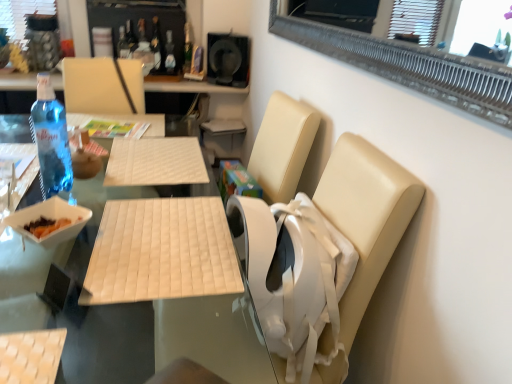
This screenshot has width=512, height=384. Find the location of `beige woven fabric armchair at lower left`. beige woven fabric armchair at lower left is located at coordinates (31, 356).

The height and width of the screenshot is (384, 512). What do you see at coordinates (228, 59) in the screenshot? I see `black matte speaker at upper center` at bounding box center [228, 59].

Describe the element at coordinates (366, 216) in the screenshot. I see `white leather chair at right` at that location.

Measure the distance between clear glass bottle at upper center, the third bottle ordered from the bottom, and camera.

They are 2.56 meters apart.

Locate an element on the screen. white quilted mat at center, marked as the first table in a top-to-bottom arrangement is located at coordinates (161, 252).

The height and width of the screenshot is (384, 512). Describe the element at coordinates (161, 252) in the screenshot. I see `white quilted mat at center, the second table in the bottom-to-top sequence` at that location.

This screenshot has width=512, height=384. In order to click on white quilted placemat at center, acting as the first table starting from the bottom in this screenshot , I will do `click(77, 299)`.

Between blue glass bottle at left, the 1th bottle in the front-to-back sequence, and transparent plastic bottle at upper center, which is the third bottle in front-to-back order, which one appears on the right side from the viewer's perspective?

Positioned to the right is transparent plastic bottle at upper center, which is the third bottle in front-to-back order.

Which object is thinner, blue glass bottle at left, the first bottle from the bottom, or transparent plastic bottle at upper center, marked as the second bottle in a back-to-front arrangement?

transparent plastic bottle at upper center, marked as the second bottle in a back-to-front arrangement, is thinner.

Where is `bottle that is the 2nd one when counting forward from the transparent plastic bottle at upper center, marked as the second bottle in a back-to-front arrangement`? This screenshot has width=512, height=384. bottle that is the 2nd one when counting forward from the transparent plastic bottle at upper center, marked as the second bottle in a back-to-front arrangement is located at coordinates (51, 139).

Is blue glass bottle at left, the first bottle from the bottom, directly adjacent to transparent plastic bottle at upper center, the second bottle in the bottom-to-top sequence?

blue glass bottle at left, the first bottle from the bottom, is not next to transparent plastic bottle at upper center, the second bottle in the bottom-to-top sequence, and they're not touching.

Considering the positions of point (185, 70) and point (64, 161), is point (185, 70) closer or farther from the camera than point (64, 161)?

Point (185, 70).

Does translucent glass bottle at upper center, marked as the 1th bottle in a back-to-front arrangement, appear on the right side of blue glass bottle at left, arranged as the 4th bottle when viewed from the top?

Yes.

From a real-world perspective, who is located higher, translucent glass bottle at upper center, which appears as the 1th bottle when viewed from the top, or blue glass bottle at left, arranged as the 4th bottle when viewed from the top?

translucent glass bottle at upper center, which appears as the 1th bottle when viewed from the top, is physically above.

Which bottle is the 4th one when counting from the left side of the black matte speaker at upper center? Please provide its 2D coordinates.

[(156, 44)]

How many degrees apart are the facing directions of black matte speaker at upper center and clear glass bottle at upper center, which appears as the 2th bottle when viewed from the top?

The angular difference between black matte speaker at upper center and clear glass bottle at upper center, which appears as the 2th bottle when viewed from the top, is 0.000471 degrees.

From the picture: From the image's perspective, is black matte speaker at upper center located beneath clear glass bottle at upper center, the third bottle in the back-to-front sequence?

Indeed, from the image's perspective, black matte speaker at upper center is shown beneath clear glass bottle at upper center, the third bottle in the back-to-front sequence.

Which of these two, black matte speaker at upper center or translucent glass bottle at upper center, marked as the 1th bottle in a back-to-front arrangement, is bigger?

black matte speaker at upper center is bigger.

Could you tell me if black matte speaker at upper center is facing translucent glass bottle at upper center, marked as the 1th bottle in a back-to-front arrangement?

No, black matte speaker at upper center is not oriented towards translucent glass bottle at upper center, marked as the 1th bottle in a back-to-front arrangement.

Is black matte speaker at upper center wider than translucent glass bottle at upper center, marked as the 1th bottle in a back-to-front arrangement?

Indeed, black matte speaker at upper center has a greater width compared to translucent glass bottle at upper center, marked as the 1th bottle in a back-to-front arrangement.

From a real-world perspective, does black matte speaker at upper center sit lower than translucent glass bottle at upper center, which is the 4th bottle from front to back?

Yes.

Does white quilted placemat at center, acting as the first table starting from the bottom, come in front of transparent plastic bottle at upper center, which is the third bottle in front-to-back order?

Yes, white quilted placemat at center, acting as the first table starting from the bottom, is in front of transparent plastic bottle at upper center, which is the third bottle in front-to-back order.

Based on the photo, would you say white quilted placemat at center, acting as the first table starting from the bottom, contains transparent plastic bottle at upper center, acting as the 3th bottle starting from the top?

No, transparent plastic bottle at upper center, acting as the 3th bottle starting from the top, is not inside white quilted placemat at center, acting as the first table starting from the bottom.

Considering the sizes of objects white quilted placemat at center, the second table from the top, and transparent plastic bottle at upper center, marked as the second bottle in a back-to-front arrangement, in the image provided, who is shorter, white quilted placemat at center, the second table from the top, or transparent plastic bottle at upper center, marked as the second bottle in a back-to-front arrangement,?

With less height is transparent plastic bottle at upper center, marked as the second bottle in a back-to-front arrangement.

Is beige woven fabric armchair at lower left at the back of blue glass bottle at left, the 1th bottle in the front-to-back sequence?

No, blue glass bottle at left, the 1th bottle in the front-to-back sequence,'s orientation is not away from beige woven fabric armchair at lower left.

Is blue glass bottle at left, the first bottle from the bottom, to the right of beige woven fabric armchair at lower left from the viewer's perspective?

No, blue glass bottle at left, the first bottle from the bottom, is not to the right of beige woven fabric armchair at lower left.

Between blue glass bottle at left, positioned as the fourth bottle in back-to-front order, and beige woven fabric armchair at lower left, which one has smaller size?

blue glass bottle at left, positioned as the fourth bottle in back-to-front order, is smaller.

In terms of size, does white leather chair at right appear bigger or smaller than white quilted mat at center, the second table in the bottom-to-top sequence?

Clearly, white leather chair at right is larger in size than white quilted mat at center, the second table in the bottom-to-top sequence.

Is white leather chair at right not near white quilted mat at center, marked as the first table in a top-to-bottom arrangement?

No, white leather chair at right is not far away from white quilted mat at center, marked as the first table in a top-to-bottom arrangement.

Considering the relative positions of white leather chair at right and white quilted mat at center, marked as the first table in a top-to-bottom arrangement, in the image provided, is white leather chair at right to the left of white quilted mat at center, marked as the first table in a top-to-bottom arrangement, from the viewer's perspective?

In fact, white leather chair at right is to the right of white quilted mat at center, marked as the first table in a top-to-bottom arrangement.

Is white leather chair at right facing away from white quilted mat at center, the second table in the bottom-to-top sequence?

No, white leather chair at right's orientation is not away from white quilted mat at center, the second table in the bottom-to-top sequence.

Locate an element on the screen. This screenshot has width=512, height=384. the 1st bottle to the left when counting from the transparent plastic bottle at upper center, marked as the second bottle in a back-to-front arrangement is located at coordinates (51, 139).

From a real-world perspective, starting from the blue glass bottle at left, the 1th bottle in the front-to-back sequence, which bottle is the 3rd one vertically above it? Please provide its 2D coordinates.

[(188, 47)]

When comparing their distances from transparent plastic bottle at upper center, which is the third bottle in front-to-back order, does blue glass bottle at left, positioned as the fourth bottle in back-to-front order, or beige woven fabric armchair at lower left seem closer?

The object closer to transparent plastic bottle at upper center, which is the third bottle in front-to-back order, is blue glass bottle at left, positioned as the fourth bottle in back-to-front order.

From the picture: From the image, which object appears to be farther from clear glass bottle at upper center, which appears as the 2th bottle when viewed from the top, blue glass bottle at left, the 1th bottle in the front-to-back sequence, or white leather chair at right?

Based on the image, white leather chair at right appears to be further to clear glass bottle at upper center, which appears as the 2th bottle when viewed from the top.

Based on their spatial positions, is white quilted mat at center, the second table in the bottom-to-top sequence, or translucent glass bottle at upper center, marked as the 1th bottle in a back-to-front arrangement, further from white leather chair at right?

translucent glass bottle at upper center, marked as the 1th bottle in a back-to-front arrangement, is further to white leather chair at right.

In the scene shown: Which object lies nearer to the anchor point white quilted mat at center, marked as the first table in a top-to-bottom arrangement, white leather chair at right or blue glass bottle at left, the first bottle from the bottom?

white leather chair at right lies closer to white quilted mat at center, marked as the first table in a top-to-bottom arrangement, than the other object.

When comparing their distances from transparent plastic bottle at upper center, which is the third bottle in front-to-back order, does white quilted mat at center, marked as the first table in a top-to-bottom arrangement, or black matte speaker at upper center seem closer?

Based on the image, black matte speaker at upper center appears to be nearer to transparent plastic bottle at upper center, which is the third bottle in front-to-back order.

From the image, which object appears to be nearer to white quilted placemat at center, acting as the first table starting from the bottom, transparent plastic bottle at upper center, the second bottle in the bottom-to-top sequence, or blue glass bottle at left, the 1th bottle in the front-to-back sequence?

blue glass bottle at left, the 1th bottle in the front-to-back sequence.

Looking at the image, which one is located closer to blue glass bottle at left, positioned as the fourth bottle in back-to-front order, transparent plastic bottle at upper center, acting as the 3th bottle starting from the top, or beige woven fabric armchair at lower left?

beige woven fabric armchair at lower left.

Estimate the real-world distances between objects in this image. Which object is closer to black matte speaker at upper center, white quilted placemat at center, the second table from the top, or translucent glass bottle at upper center, the fourth bottle in the bottom-to-top sequence?

The object closer to black matte speaker at upper center is translucent glass bottle at upper center, the fourth bottle in the bottom-to-top sequence.

The image size is (512, 384). What are the coordinates of `chair located between white quilted placemat at center, acting as the first table starting from the bottom, and transparent plastic bottle at upper center, which is the third bottle in front-to-back order, in the depth direction` in the screenshot? It's located at (366, 216).

You are a GUI agent. You are given a task and a screenshot of the screen. Output one action in this format:
    pyautogui.click(x=<x>, y=<y>)
    Task: Click on the bottle between beige woven fabric armchair at lower left and black matte speaker at upper center in the front-back direction
    
    Given the screenshot: What is the action you would take?
    tap(51, 139)

Where is `chair positioned between white quilted placemat at center, the second table from the top, and clear glass bottle at upper center, the third bottle in the back-to-front sequence, from near to far`? The height and width of the screenshot is (384, 512). chair positioned between white quilted placemat at center, the second table from the top, and clear glass bottle at upper center, the third bottle in the back-to-front sequence, from near to far is located at coordinates (366, 216).

Locate an element on the screen. This screenshot has height=384, width=512. bottle between beige woven fabric armchair at lower left and clear glass bottle at upper center, which appears as the 2th bottle when viewed from the top, from front to back is located at coordinates (51, 139).